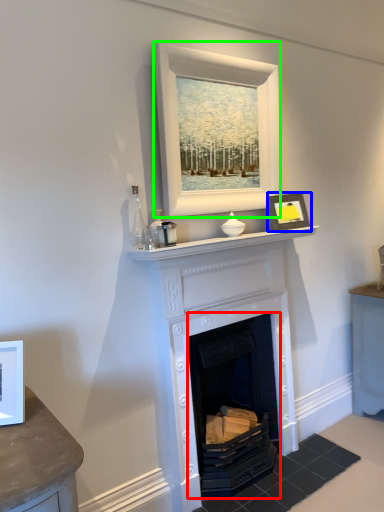
Question: Which object is the farthest from fireplace (highlighted by a red box)? Choose among these: picture frame (highlighted by a blue box) or picture frame (highlighted by a green box).

Choices:
 (A) picture frame
 (B) picture frame

Answer: (B)